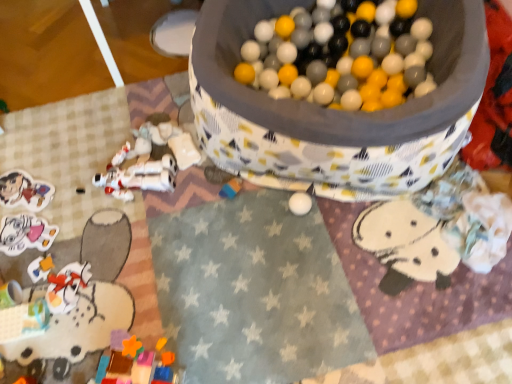
Locate an element on the screen. The width and height of the screenshot is (512, 384). free space between plastic toy figure at lower left, positioned as the third toy in left-to-right order, and matte white sticker at lower left, which appears as the 2th toy when viewed from the left is located at coordinates (41, 260).